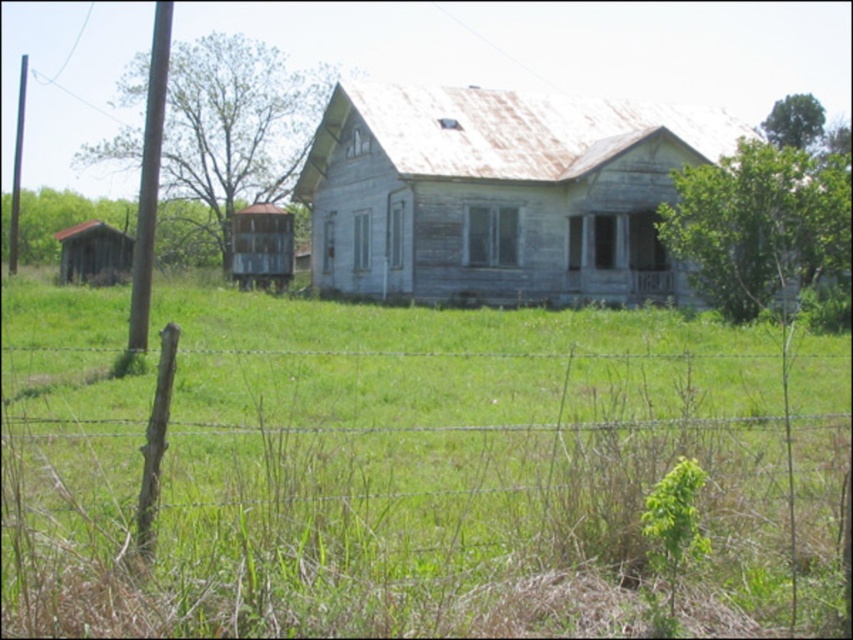
You are standing in the field looking towards the old house. You notice the barbed wire fence at lower left and the green leafy plant at lower right. Which object is closer to your left side?

The barbed wire fence at lower left is to the left of the green leafy plant at lower right, so it is closer to your left side.

You are standing at the point with coordinates point (x=419, y=484) in the scene. What object are you facing?

The point (x=419, y=484) corresponds to the barbed wire fence at lower left, so you are facing the barbed wire fence at lower left.

Based on the photo, you are standing in a field and see the barbed wire fence at lower left and the green leafy plant at lower right. Which object is nearer to you?

The barbed wire fence at lower left is closer to the viewer than the green leafy plant at lower right.